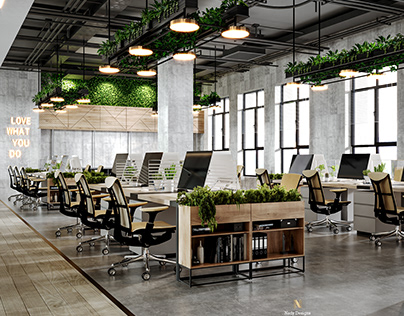
At what (x,y) coordinates should I click in order to perform the action: click on neon words. Please return your answer as a coordinate pair (x, y). Looking at the image, I should click on (18, 120), (16, 132), (18, 146), (12, 155).